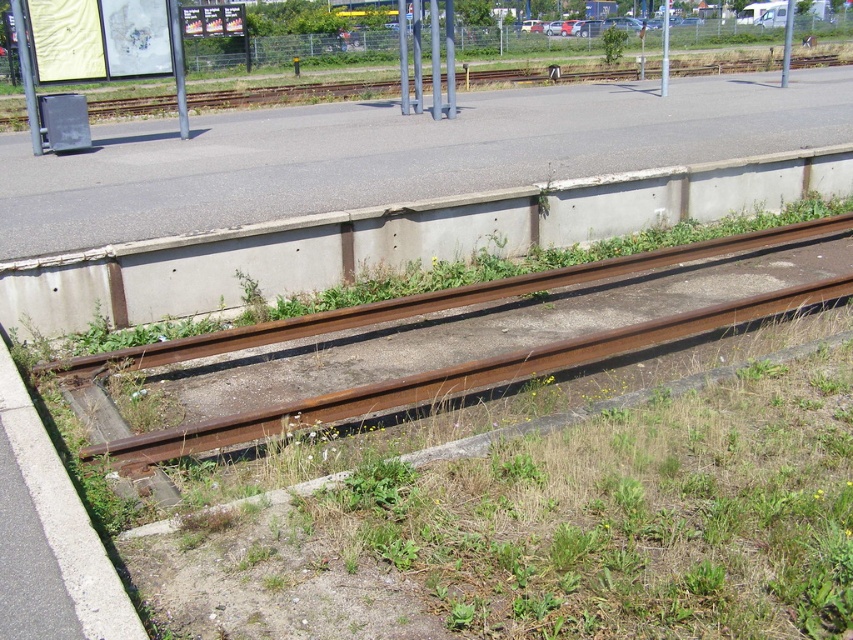
You are a construction worker assessing the railway site. You need to determine which area is wider between the concrete at lower left and the green leafy plant at center. Which one is wider?

The green leafy plant at center is wider than the concrete at lower left because the concrete at lower left has a lesser width compared to the green leafy plant at center.

You are a maintenance worker inspecting the railway tracks. You notice the green grass at bottom and the concrete at center. Which object is closer to you from your current position?

The green grass at bottom is closer to you because it is in front of the concrete at center.